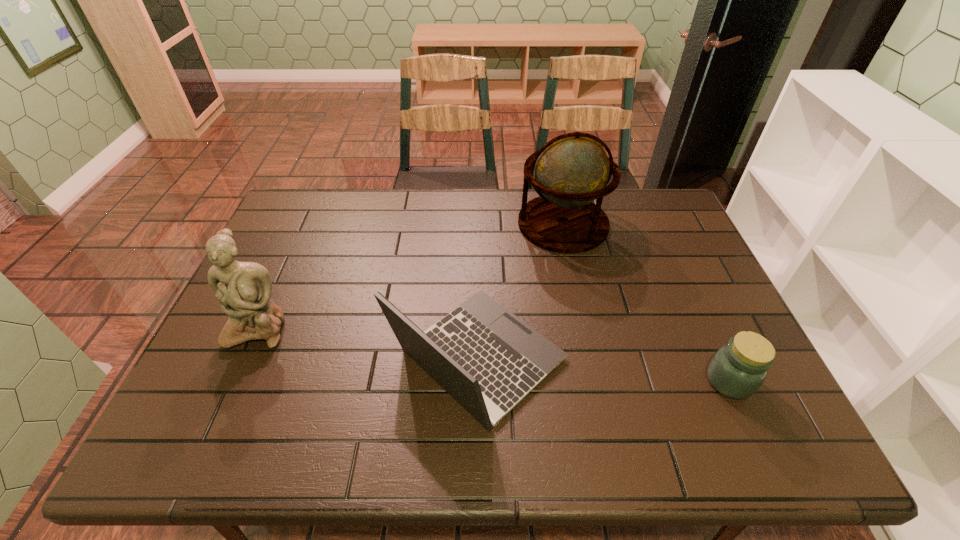
This screenshot has width=960, height=540. I want to click on free space between the laptop_computer and the rightmost object, so click(604, 370).

Image resolution: width=960 pixels, height=540 pixels. I want to click on vacant area that lies between the farthest object and the second shortest object, so click(520, 292).

Locate an element on the screen. vacant space in between the globe and the leftmost object is located at coordinates (411, 275).

This screenshot has width=960, height=540. Identify the location of blank region between the jar and the farthest object. (646, 302).

This screenshot has width=960, height=540. Find the location of `free space between the jar and the second shortest object`. free space between the jar and the second shortest object is located at coordinates (604, 370).

The image size is (960, 540). I want to click on vacant area that lies between the figurine and the laptop_computer, so click(369, 343).

Image resolution: width=960 pixels, height=540 pixels. Identify the location of vacant region between the laptop_computer and the leftmost object. (369, 343).

Find the location of a particular element. The image size is (960, 540). free space that is in between the jar and the farthest object is located at coordinates (646, 302).

The height and width of the screenshot is (540, 960). I want to click on object that is the second closest to the third tallest object, so click(244, 289).

Locate which object is the closest to the farthest object. Please provide its 2D coordinates. Your answer should be formatted as a tuple, i.e. [(x, y)], where the tuple contains the x and y coordinates of a point satisfying the conditions above.

[(485, 357)]